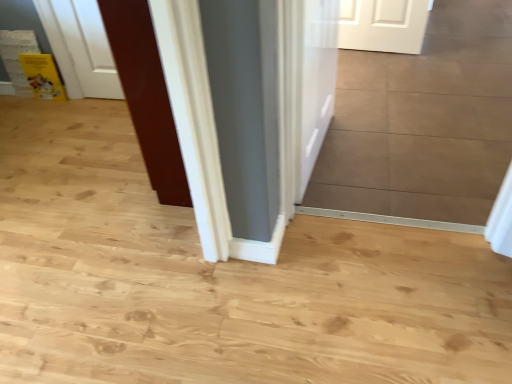
Where is `empty space that is to the right of white glossy door at center, which appears as the 1th door when viewed from the right`? The image size is (512, 384). empty space that is to the right of white glossy door at center, which appears as the 1th door when viewed from the right is located at coordinates (375, 157).